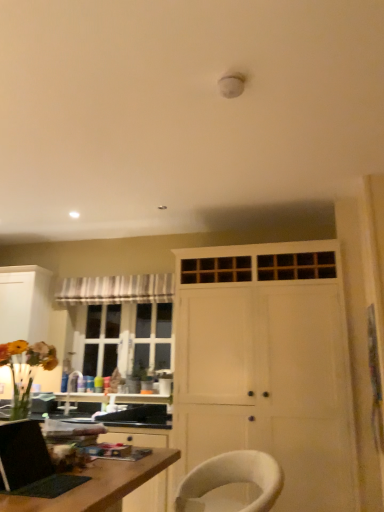
In order to click on free space underneath matte black laptop at lower left (from a real-world perspective) in this screenshot , I will do `click(32, 490)`.